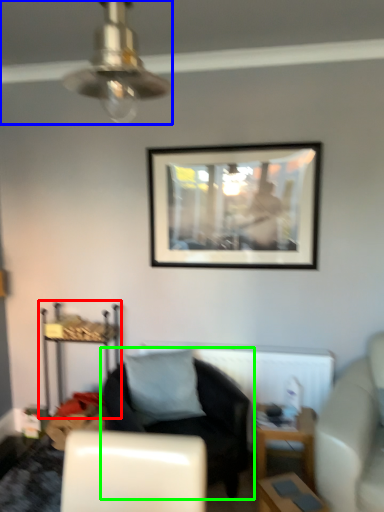
Question: Which object is the farthest from dresser (highlighted by a red box)? Choose among these: ceiling fan (highlighted by a blue box) or chair (highlighted by a green box).

Choices:
 (A) ceiling fan
 (B) chair

Answer: (A)